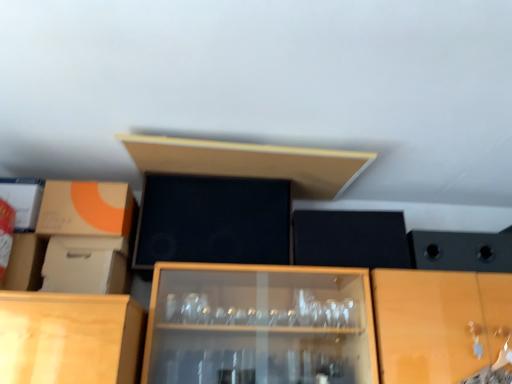
How much space does matte cardboard box at left, which is the first cardboard box from top to bottom, occupy horizontally?

matte cardboard box at left, which is the first cardboard box from top to bottom, is 11.14 inches wide.

Image resolution: width=512 pixels, height=384 pixels. Describe the element at coordinates (212, 220) in the screenshot. I see `black matte speaker at center` at that location.

This screenshot has width=512, height=384. I want to click on matte wood shelf at upper center, so click(251, 162).

Where is `box above the matte cardboard box at left, the second cardboard box positioned from the bottom (from a real-world perspective)`? box above the matte cardboard box at left, the second cardboard box positioned from the bottom (from a real-world perspective) is located at coordinates (212, 220).

Is black matte speaker at center oriented away from matte cardboard box at left, which is the first cardboard box from top to bottom?

black matte speaker at center is not turned away from matte cardboard box at left, which is the first cardboard box from top to bottom.

Can you confirm if black matte speaker at center is positioned to the left of matte cardboard box at left, which is the first cardboard box from top to bottom?

No, black matte speaker at center is not to the left of matte cardboard box at left, which is the first cardboard box from top to bottom.

Is black matte speaker at center located outside matte cardboard box at left, the second cardboard box positioned from the bottom?

Yes.

Can you confirm if matte cardboard box at left, the second cardboard box positioned from the bottom, is shorter than black matte speaker at center?

Correct, matte cardboard box at left, the second cardboard box positioned from the bottom, is not as tall as black matte speaker at center.

Is matte cardboard box at left, which is the first cardboard box from top to bottom, to the right of black matte speaker at center from the viewer's perspective?

No, matte cardboard box at left, which is the first cardboard box from top to bottom, is not to the right of black matte speaker at center.

Looking at this image, from a real-world perspective, which object rests below the other?

In real-world perspective, matte cardboard box at left, which is the first cardboard box from top to bottom, is lower.

Is matte wood shelf at upper center closer to the viewer compared to matte cardboard box at left, which is the first cardboard box from top to bottom?

Yes, matte wood shelf at upper center is closer to the camera.

Does matte wood shelf at upper center have a smaller size compared to matte cardboard box at left, the second cardboard box positioned from the bottom?

No, matte wood shelf at upper center is not smaller than matte cardboard box at left, the second cardboard box positioned from the bottom.

Based on the photo, from a real-world perspective, who is located lower, matte wood shelf at upper center or matte cardboard box at left, the second cardboard box positioned from the bottom?

In real-world perspective, matte cardboard box at left, the second cardboard box positioned from the bottom, is lower.

From the image's perspective, is black matte speaker at center on top of matte wood shelf at upper center?

No.

Does black matte speaker at center have a lesser height compared to matte wood shelf at upper center?

In fact, black matte speaker at center may be taller than matte wood shelf at upper center.

Between black matte speaker at center and matte wood shelf at upper center, which one has larger size?

matte wood shelf at upper center is bigger.

Choose the correct answer: Is black matte speaker at center inside matte wood shelf at upper center or outside it?

black matte speaker at center is not enclosed by matte wood shelf at upper center.

Looking at this image, from their relative heights in the image, would you say white cardboard box at left, which is counted as the 1th cardboard box, starting from the bottom, is taller or shorter than matte cardboard box at left, which is the first cardboard box from top to bottom?

white cardboard box at left, which is counted as the 1th cardboard box, starting from the bottom, is shorter than matte cardboard box at left, which is the first cardboard box from top to bottom.

Is the surface of white cardboard box at left, arranged as the second cardboard box when viewed from the top, in direct contact with matte cardboard box at left, which is the first cardboard box from top to bottom?

No, white cardboard box at left, arranged as the second cardboard box when viewed from the top, is not next to matte cardboard box at left, which is the first cardboard box from top to bottom.

Locate an element on the screen. cardboard box above the white cardboard box at left, arranged as the second cardboard box when viewed from the top (from the image's perspective) is located at coordinates (85, 208).

Looking at this image, can you confirm if white cardboard box at left, arranged as the second cardboard box when viewed from the top, is positioned to the left of matte cardboard box at left, which is the first cardboard box from top to bottom?

In fact, white cardboard box at left, arranged as the second cardboard box when viewed from the top, is to the right of matte cardboard box at left, which is the first cardboard box from top to bottom.

Could you measure the distance between black matte speaker at center and white cardboard box at left, arranged as the second cardboard box when viewed from the top?

black matte speaker at center is 13.01 inches from white cardboard box at left, arranged as the second cardboard box when viewed from the top.

From the picture: Is black matte speaker at center facing towards white cardboard box at left, arranged as the second cardboard box when viewed from the top?

No, black matte speaker at center is not facing towards white cardboard box at left, arranged as the second cardboard box when viewed from the top.

Which cardboard box is the 2nd one when counting from the front of the black matte speaker at center? Please provide its 2D coordinates.

[(85, 265)]

Can we say black matte speaker at center lies outside white cardboard box at left, arranged as the second cardboard box when viewed from the top?

Yes, black matte speaker at center is not within white cardboard box at left, arranged as the second cardboard box when viewed from the top.

You are a GUI agent. You are given a task and a screenshot of the screen. Output one action in this format:
    pyautogui.click(x=<x>, y=<y>)
    Task: Click on the 1st cardboard box counting from the left side of the matte wood shelf at upper center
    
    Given the screenshot: What is the action you would take?
    pyautogui.click(x=85, y=265)

Which is more to the right, white cardboard box at left, which is counted as the 1th cardboard box, starting from the bottom, or matte wood shelf at upper center?

Positioned to the right is matte wood shelf at upper center.

Measure the distance between white cardboard box at left, arranged as the second cardboard box when viewed from the top, and matte wood shelf at upper center.

21.23 inches.

Who is bigger, white cardboard box at left, arranged as the second cardboard box when viewed from the top, or matte wood shelf at upper center?

matte wood shelf at upper center is bigger.

At what (x,y) coordinates should I click in order to perform the action: click on the 1st cardboard box in front of the black matte speaker at center, starting your count from the anchor. Please return your answer as a coordinate pair (x, y). Image resolution: width=512 pixels, height=384 pixels. Looking at the image, I should click on (85, 208).

Where is `cardboard box above the black matte speaker at center (from the image's perspective)`? cardboard box above the black matte speaker at center (from the image's perspective) is located at coordinates (85, 208).

Estimate the real-world distances between objects in this image. Which object is closer to matte wood shelf at upper center, white cardboard box at left, which is counted as the 1th cardboard box, starting from the bottom, or black matte speaker at center?

Based on the image, black matte speaker at center appears to be nearer to matte wood shelf at upper center.

Based on their spatial positions, is black matte speaker at center or white cardboard box at left, which is counted as the 1th cardboard box, starting from the bottom, closer to matte wood shelf at upper center?

Based on the image, black matte speaker at center appears to be nearer to matte wood shelf at upper center.

Estimate the real-world distances between objects in this image. Which object is further from matte cardboard box at left, which is the first cardboard box from top to bottom, black matte speaker at center or matte wood shelf at upper center?

matte wood shelf at upper center is further to matte cardboard box at left, which is the first cardboard box from top to bottom.

Based on their spatial positions, is matte wood shelf at upper center or white cardboard box at left, which is counted as the 1th cardboard box, starting from the bottom, further from black matte speaker at center?

Among the two, white cardboard box at left, which is counted as the 1th cardboard box, starting from the bottom, is located further to black matte speaker at center.

From the image, which object appears to be farther from matte wood shelf at upper center, matte cardboard box at left, which is the first cardboard box from top to bottom, or black matte speaker at center?

The object further to matte wood shelf at upper center is matte cardboard box at left, which is the first cardboard box from top to bottom.

When comparing their distances from matte wood shelf at upper center, does matte cardboard box at left, the second cardboard box positioned from the bottom, or white cardboard box at left, arranged as the second cardboard box when viewed from the top, seem closer?

matte cardboard box at left, the second cardboard box positioned from the bottom, lies closer to matte wood shelf at upper center than the other object.

Which object lies nearer to the anchor point white cardboard box at left, arranged as the second cardboard box when viewed from the top, black matte speaker at center or matte cardboard box at left, which is the first cardboard box from top to bottom?

matte cardboard box at left, which is the first cardboard box from top to bottom.

Considering their positions, is matte cardboard box at left, which is the first cardboard box from top to bottom, positioned further to white cardboard box at left, which is counted as the 1th cardboard box, starting from the bottom, than black matte speaker at center?

Among the two, black matte speaker at center is located further to white cardboard box at left, which is counted as the 1th cardboard box, starting from the bottom.

Locate an element on the screen. The width and height of the screenshot is (512, 384). box located between matte cardboard box at left, which is the first cardboard box from top to bottom, and matte wood shelf at upper center in the left-right direction is located at coordinates (212, 220).

Find the location of `cardboard box between matte cardboard box at left, the second cardboard box positioned from the bottom, and matte wood shelf at upper center from left to right`. cardboard box between matte cardboard box at left, the second cardboard box positioned from the bottom, and matte wood shelf at upper center from left to right is located at coordinates (85, 265).

I want to click on cardboard box located between matte cardboard box at left, the second cardboard box positioned from the bottom, and black matte speaker at center in the left-right direction, so click(85, 265).

Find the location of `box situated between white cardboard box at left, which is counted as the 1th cardboard box, starting from the bottom, and matte wood shelf at upper center from left to right`. box situated between white cardboard box at left, which is counted as the 1th cardboard box, starting from the bottom, and matte wood shelf at upper center from left to right is located at coordinates (212, 220).